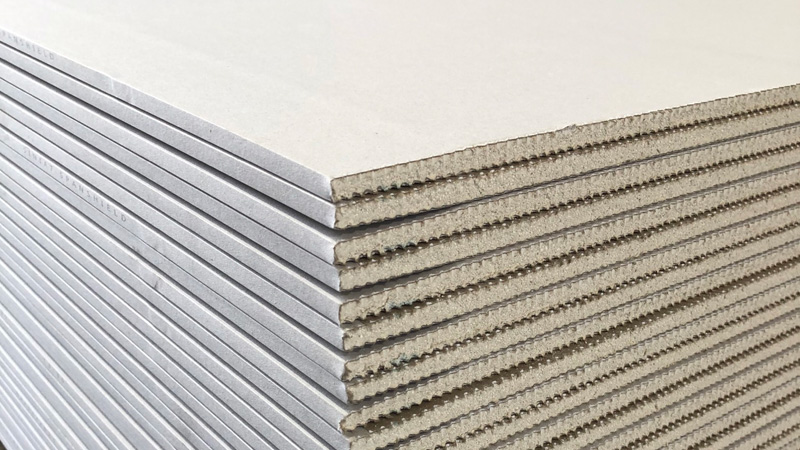
Locate an element on the screen. The image size is (800, 450). sheet #2 is located at coordinates (178, 142).